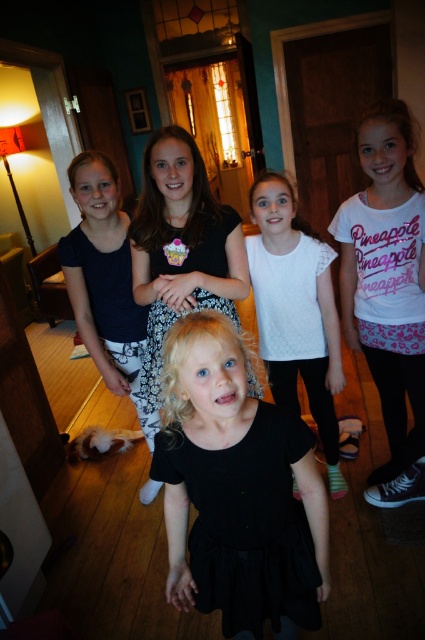
You are a photographer setting up for a group photo. You notice the black matte dress at center and the white cotton shirt at upper right. Which clothing item is closer to the camera?

The black matte dress at center is positioned under the white cotton shirt at upper right, meaning it is closer to the camera since it is below the other item in the frame.

You are a photographer setting up for a group photo in the room. You need to adjust the lighting so that both the white textured shirt at center and the black cotton dress at center are well lit. Since the stained glass window provides natural light, which object should you position closer to the window to ensure proper exposure?

The white textured shirt at center should be positioned closer to the window because it is positioned under the black cotton dress at center, so moving it forward would allow it to receive more light from the stained glass window for better exposure.

You are a photographer trying to capture a group shot of the children. The two boys wearing white shirts are positioned at different spots. The white cotton shirt at upper right and the white textured shirt at center are part of the group. How far apart are these two white shirts in inches?

The white cotton shirt at upper right and the white textured shirt at center are 9.89 inches apart.